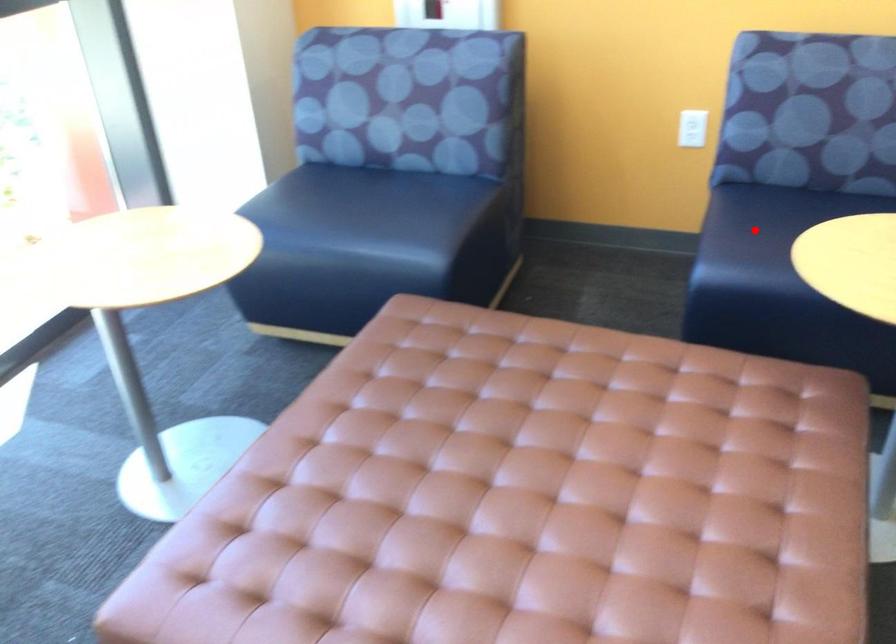
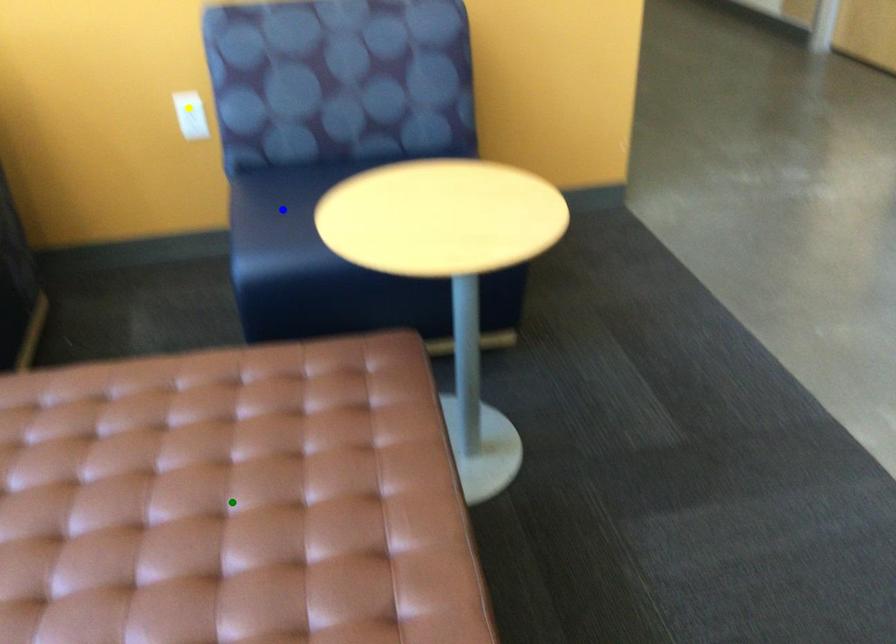
Question: I am providing you with two images of the same scene from different viewpoints. A red point is marked on the first image. You are given multiple points on the second image. Which point in image 2 is actually the same real-world point as the red point in image 1?

Choices:
 (A) green point
 (B) blue point
 (C) yellow point

Answer: (B)